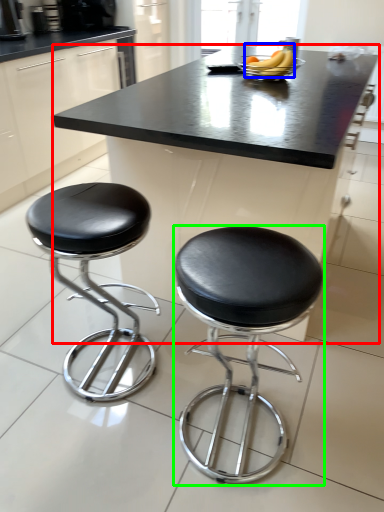
Question: Estimate the real-world distances between objects in this image. Which object is closer to table (highlighted by a red box), banana (highlighted by a blue box) or stool (highlighted by a green box)?

Choices:
 (A) banana
 (B) stool

Answer: (A)